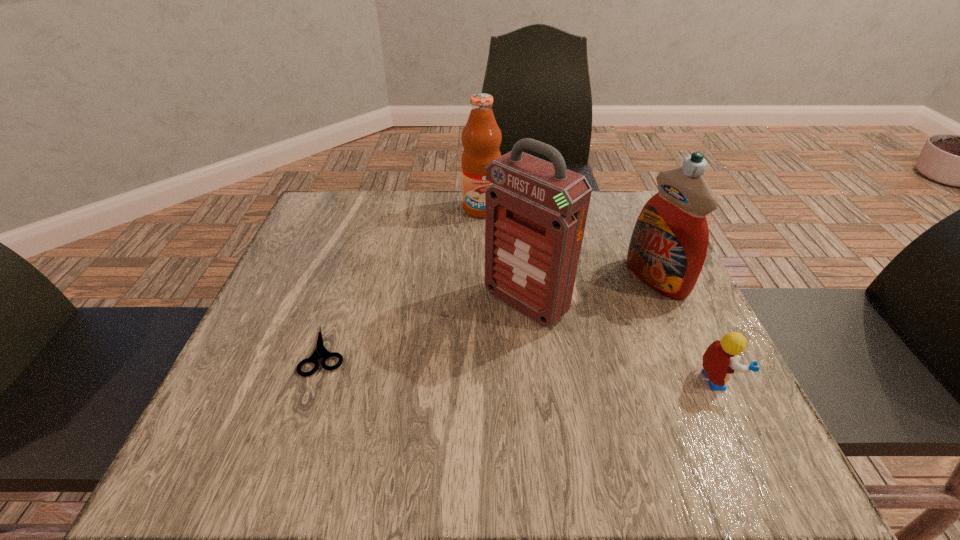
Identify the location of Lego situated at the right edge. This screenshot has width=960, height=540. (720, 360).

You are a GUI agent. You are given a task and a screenshot of the screen. Output one action in this format:
    pyautogui.click(x=<x>, y=<y>)
    Task: Click on the detergent present at the right edge
    Image resolution: width=960 pixels, height=540 pixels.
    Given the screenshot: What is the action you would take?
    pyautogui.click(x=668, y=247)

Where is `object that is at the near left corner`? object that is at the near left corner is located at coordinates (320, 351).

What are the coordinates of `object positioned at the near right corner` in the screenshot? It's located at (720, 360).

Identify the location of free region at the far edge of the desktop. Image resolution: width=960 pixels, height=540 pixels. (457, 232).

Identify the location of vacant space at the left edge of the desktop. (287, 290).

In the image, there is a desktop. Identify the location of vacant space at the right edge. (629, 291).

This screenshot has width=960, height=540. In order to click on vacant space at the far left corner in this screenshot , I will do `click(352, 217)`.

Locate an element on the screen. The width and height of the screenshot is (960, 540). vacant region at the far right corner of the desktop is located at coordinates (612, 204).

Locate an element on the screen. Image resolution: width=960 pixels, height=540 pixels. free space at the near right corner is located at coordinates (693, 419).